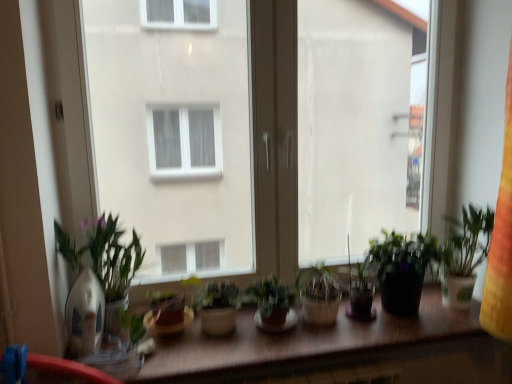
What is the approximate width of white matte window screen at center, arranged as the 2th window screen when viewed from the right?

The width of white matte window screen at center, arranged as the 2th window screen when viewed from the right, is 4.03 inches.

Locate an element on the screen. white matte window screen at center, arranged as the 2th window screen when viewed from the right is located at coordinates (174, 130).

Describe the element at coordinates (271, 304) in the screenshot. The height and width of the screenshot is (384, 512). I see `green matte plant at center, which is the 2th houseplant from right to left` at that location.

Measure the distance between transparent plastic window screen at center, which is the 1th window screen in right-to-left order, and camera.

5.43 feet.

In order to face transparent glass window at center, should I rotate leftwards or rightwards?

You should rotate right by 4.235 degrees.

You are a GUI agent. You are given a task and a screenshot of the screen. Output one action in this format:
    pyautogui.click(x=<x>, y=<y>)
    Task: Click on the matte brown pot at center, which appears as the fourth houseplant when viewed from the right
    This screenshot has width=512, height=384.
    Given the screenshot: What is the action you would take?
    pyautogui.click(x=189, y=283)

Which is more to the right, white matte window screen at center, arranged as the 2th window screen when viewed from the right, or green matte plant at center, which is the 2th houseplant from right to left?

Positioned to the right is green matte plant at center, which is the 2th houseplant from right to left.

Which is behind, point (108, 58) or point (280, 293)?

Positioned behind is point (108, 58).

Is white matte window screen at center, arranged as the 2th window screen when viewed from the right, closer to camera compared to green matte plant at center, which is counted as the 3th houseplant, starting from the left?

Yes, it is.

I want to click on the 2nd houseplant positioned below the white matte window screen at center, arranged as the 2th window screen when viewed from the right (from a real-world perspective), so click(271, 304).

From a real-world perspective, which houseplant is the 3rd one above the matte brown pot at center, which appears as the fourth houseplant when viewed from the right? Please provide its 2D coordinates.

[(402, 269)]

From the image's perspective, which one is positioned lower, matte brown pot at center, which appears as the fourth houseplant when viewed from the right, or translucent plastic pot at center, acting as the 4th houseplant starting from the left?

matte brown pot at center, which appears as the fourth houseplant when viewed from the right, appears lower in the image.

Are matte brown pot at center, which appears as the fourth houseplant when viewed from the right, and translucent plastic pot at center, acting as the 4th houseplant starting from the left, far apart?

No, there isn't a large distance between matte brown pot at center, which appears as the fourth houseplant when viewed from the right, and translucent plastic pot at center, acting as the 4th houseplant starting from the left.

From a real-world perspective, relative to translucent plastic pot at center, which is the first houseplant in right-to-left order, is matte brown pot at center, which appears as the fourth houseplant when viewed from the right, vertically above or below?

From a real-world perspective, matte brown pot at center, which appears as the fourth houseplant when viewed from the right, is physically below translucent plastic pot at center, which is the first houseplant in right-to-left order.

Consider the image. Looking at their sizes, would you say wooden table at center is wider or thinner than translucent plastic pot at center, which is the first houseplant in right-to-left order?

In the image, wooden table at center appears to be wider than translucent plastic pot at center, which is the first houseplant in right-to-left order.

Which object is further away from the camera, wooden table at center or translucent plastic pot at center, which is the first houseplant in right-to-left order?

translucent plastic pot at center, which is the first houseplant in right-to-left order, is further away from the camera.

Image resolution: width=512 pixels, height=384 pixels. Find the location of `houseplant that is the 4th one when counting upward from the wooden table at center (from the image's perspective)`. houseplant that is the 4th one when counting upward from the wooden table at center (from the image's perspective) is located at coordinates (402, 269).

Is translucent plastic pot at center, acting as the 4th houseplant starting from the left, inside wooden table at center?

No, translucent plastic pot at center, acting as the 4th houseplant starting from the left, is not surrounded by wooden table at center.

Is translucent plastic pot at center, acting as the 4th houseplant starting from the left, smaller than wooden table at center?

Correct, translucent plastic pot at center, acting as the 4th houseplant starting from the left, occupies less space than wooden table at center.

From the image's perspective, which is above, translucent plastic pot at center, acting as the 4th houseplant starting from the left, or wooden table at center?

From the image's view, translucent plastic pot at center, acting as the 4th houseplant starting from the left, is above.

Which point is more distant from viewer, [393,285] or [325,353]?

The point [393,285] is more distant.

This screenshot has height=384, width=512. Identify the location of table in front of the translucent plastic pot at center, which is the first houseplant in right-to-left order. (302, 339).

How different are the orientations of translucent plastic pot at center, acting as the 4th houseplant starting from the left, and matte brown pot at center, which appears as the fourth houseplant when viewed from the right, in degrees?

The angle between the facing direction of translucent plastic pot at center, acting as the 4th houseplant starting from the left, and the facing direction of matte brown pot at center, which appears as the fourth houseplant when viewed from the right, is 1.45 degrees.

Between translucent plastic pot at center, acting as the 4th houseplant starting from the left, and matte brown pot at center, which is the 1th houseplant from left to right, which one appears on the right side from the viewer's perspective?

Positioned to the right is translucent plastic pot at center, acting as the 4th houseplant starting from the left.

Does point (408, 312) come in front of point (197, 279)?

Yes, it is in front of point (197, 279).

From a real-world perspective, between transparent plastic window screen at center, which is the 1th window screen in right-to-left order, and green matte plant at center, which is counted as the third houseplant, starting from the right, who is vertically lower?

In real-world perspective, green matte plant at center, which is counted as the third houseplant, starting from the right, is lower.

From the image's perspective, is transparent plastic window screen at center, which is the 1th window screen in right-to-left order, above green matte plant at center, which is counted as the third houseplant, starting from the right?

Yes, from the image's perspective, transparent plastic window screen at center, which is the 1th window screen in right-to-left order, is above green matte plant at center, which is counted as the third houseplant, starting from the right.

Could you tell me if transparent plastic window screen at center, acting as the 2th window screen starting from the left, is facing green matte plant at center, positioned as the 2th houseplant in left-to-right order?

No, transparent plastic window screen at center, acting as the 2th window screen starting from the left, does not turn towards green matte plant at center, positioned as the 2th houseplant in left-to-right order.

Considering the relative sizes of transparent plastic window screen at center, which is the 1th window screen in right-to-left order, and green matte plant at center, positioned as the 2th houseplant in left-to-right order, in the image provided, is transparent plastic window screen at center, which is the 1th window screen in right-to-left order, taller than green matte plant at center, positioned as the 2th houseplant in left-to-right order,?

Yes.

Does green matte plant at center, which is counted as the 3th houseplant, starting from the left, have a larger size compared to wooden table at center?

No, green matte plant at center, which is counted as the 3th houseplant, starting from the left, is not bigger than wooden table at center.

Which is in front, point (290, 317) or point (330, 341)?

The point (330, 341) is closer to the camera.

The width and height of the screenshot is (512, 384). In the image, there is a green matte plant at center, which is the 2th houseplant from right to left. Identify the location of table below it (from a real-world perspective). [x=302, y=339].

From the image's perspective, between green matte plant at center, which is the 2th houseplant from right to left, and wooden table at center, who is located below?

wooden table at center is shown below in the image.

At what (x,y) coordinates should I click in order to perform the action: click on the 2nd houseplant below the white matte window screen at center, which is the 1th window screen in left-to-right order (from the image's perspective). Please return your answer as a coordinate pair (x, y). This screenshot has width=512, height=384. Looking at the image, I should click on (271, 304).

Locate an element on the screen. This screenshot has width=512, height=384. houseplant that is the 2nd one when counting backward from the matte brown pot at center, which appears as the fourth houseplant when viewed from the right is located at coordinates (402, 269).

Looking at the image, which one is located closer to transparent glass window at center, green matte plant at center, which is counted as the third houseplant, starting from the right, or green matte plant at center, which is the 2th houseplant from right to left?

The object closer to transparent glass window at center is green matte plant at center, which is the 2th houseplant from right to left.

When comparing their distances from green matte plant at center, which is counted as the third houseplant, starting from the right, does transparent glass window at center or white matte window screen at center, which is the 1th window screen in left-to-right order, seem further?

white matte window screen at center, which is the 1th window screen in left-to-right order.

From the image, which object appears to be nearer to green matte plant at center, which is counted as the third houseplant, starting from the right, transparent glass window at center or translucent plastic pot at center, which is the first houseplant in right-to-left order?

Among the two, transparent glass window at center is located nearer to green matte plant at center, which is counted as the third houseplant, starting from the right.

From the image, which object appears to be farther from green matte plant at center, positioned as the 2th houseplant in left-to-right order, wooden table at center or white matte window screen at center, arranged as the 2th window screen when viewed from the right?

white matte window screen at center, arranged as the 2th window screen when viewed from the right, is further to green matte plant at center, positioned as the 2th houseplant in left-to-right order.

From the image, which object appears to be nearer to transparent plastic window screen at center, which is the 1th window screen in right-to-left order, white matte window screen at center, arranged as the 2th window screen when viewed from the right, or green matte plant at center, which is counted as the 3th houseplant, starting from the left?

green matte plant at center, which is counted as the 3th houseplant, starting from the left, is closer to transparent plastic window screen at center, which is the 1th window screen in right-to-left order.

Consider the image. Looking at the image, which one is located closer to green matte plant at center, which is counted as the third houseplant, starting from the right, green matte plant at center, which is counted as the 3th houseplant, starting from the left, or white matte window screen at center, which is the 1th window screen in left-to-right order?

green matte plant at center, which is counted as the 3th houseplant, starting from the left, is closer to green matte plant at center, which is counted as the third houseplant, starting from the right.

From the image, which object appears to be nearer to green matte plant at center, which is the 2th houseplant from right to left, translucent plastic pot at center, acting as the 4th houseplant starting from the left, or matte brown pot at center, which appears as the fourth houseplant when viewed from the right?

matte brown pot at center, which appears as the fourth houseplant when viewed from the right, is closer to green matte plant at center, which is the 2th houseplant from right to left.

Which object lies further to the anchor point transparent plastic window screen at center, which is the 1th window screen in right-to-left order, green matte plant at center, positioned as the 2th houseplant in left-to-right order, or wooden table at center?

green matte plant at center, positioned as the 2th houseplant in left-to-right order, lies further to transparent plastic window screen at center, which is the 1th window screen in right-to-left order, than the other object.

The height and width of the screenshot is (384, 512). Find the location of `window between white matte window screen at center, which is the 1th window screen in left-to-right order, and translucent plastic pot at center, acting as the 4th houseplant starting from the left, from left to right`. window between white matte window screen at center, which is the 1th window screen in left-to-right order, and translucent plastic pot at center, acting as the 4th houseplant starting from the left, from left to right is located at coordinates (274, 136).

At what (x,y) coordinates should I click in order to perform the action: click on houseplant between matte brown pot at center, which appears as the fourth houseplant when viewed from the right, and green matte plant at center, which is the 2th houseplant from right to left, from left to right. Please return your answer as a coordinate pair (x, y). The height and width of the screenshot is (384, 512). Looking at the image, I should click on tap(217, 307).

The image size is (512, 384). Identify the location of window screen between transparent glass window at center and green matte plant at center, which is counted as the third houseplant, starting from the right, in the vertical direction. (174, 130).

At what (x,y) coordinates should I click in order to perform the action: click on window screen located between matte brown pot at center, which is the 1th houseplant from left to right, and transparent plastic window screen at center, acting as the 2th window screen starting from the left, in the left-right direction. Please return your answer as a coordinate pair (x, y). The image size is (512, 384). Looking at the image, I should click on (174, 130).